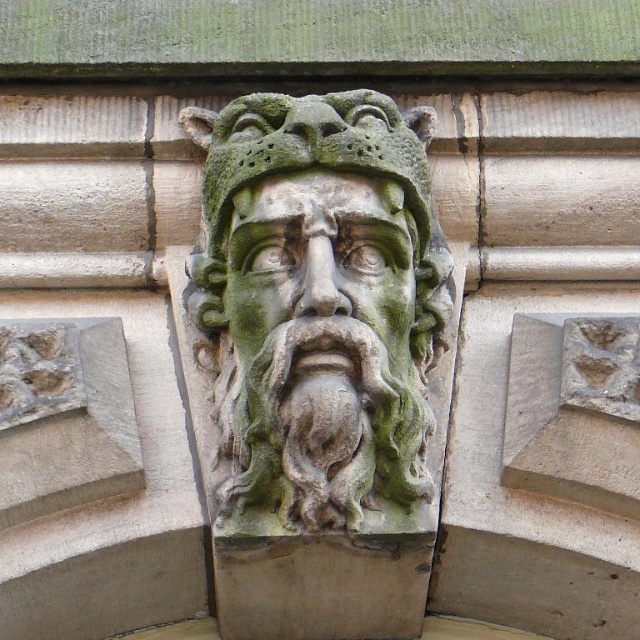
You are an archaeologist examining a stone carving. You notice a point marked at coordinates (317,301). Based on the scene, what does this point likely indicate?

The point marked at coordinates (317,301) indicates the location of the green stone head at center.

You are an architect examining the carved stone face. You notice two points marked on the image at coordinates point (410,122) and point (412,269). Based on their positions, which point is closer to the front of the stone carving?

Point (412,269) is closer to the front of the stone carving because it is in front of point (410,122).